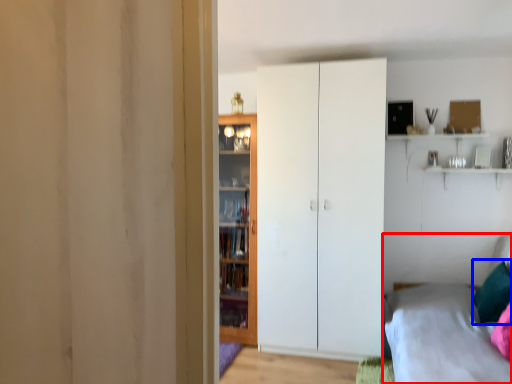
Question: Which object is closer to the camera taking this photo, bed (highlighted by a red box) or pillow (highlighted by a blue box)?

Choices:
 (A) bed
 (B) pillow

Answer: (A)